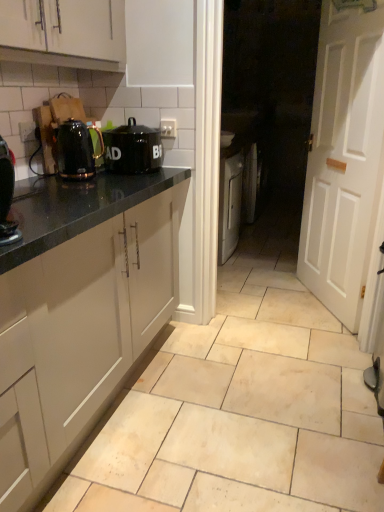
The image size is (384, 512). Identify the location of vacant space that is to the left of white wooden door at right. click(x=272, y=302).